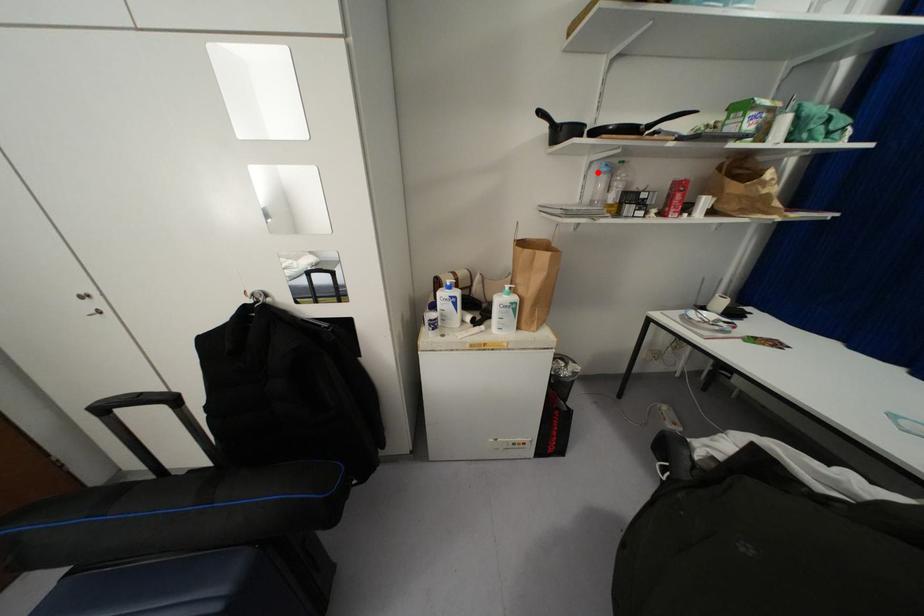
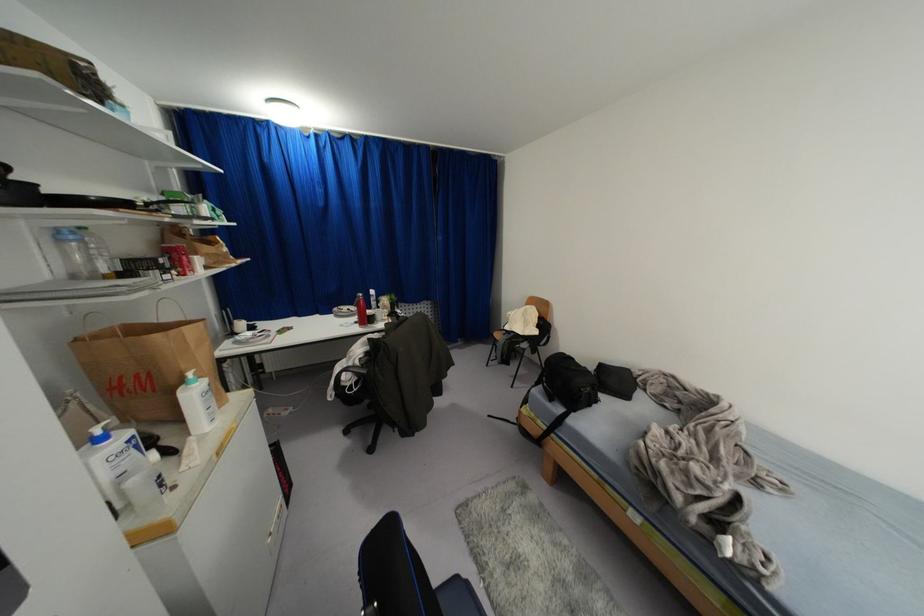
In the second image, find the point that corresponds to the highlighted location in the first image.

(62, 240)